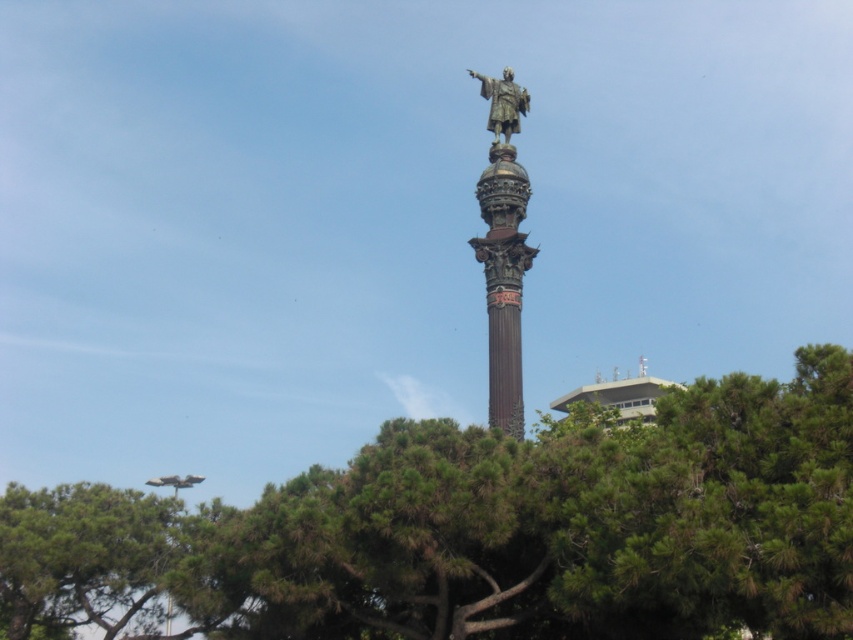
Question: Which object is the closest to the bronze statue at center?

Choices:
 (A) green textured tree at center
 (B) bronze statue at upper center

Answer: (B)

Question: Is green textured tree at center in front of bronze statue at upper center?

Choices:
 (A) yes
 (B) no

Answer: (A)

Question: Which object is positioned farthest from the bronze statue at upper center?

Choices:
 (A) green textured tree at center
 (B) bronze statue at center

Answer: (A)

Question: Estimate the real-world distances between objects in this image. Which object is farther from the green textured tree at center?

Choices:
 (A) bronze statue at center
 (B) bronze statue at upper center

Answer: (B)

Question: Is bronze statue at center further to the viewer compared to bronze statue at upper center?

Choices:
 (A) no
 (B) yes

Answer: (A)

Question: Does bronze statue at center have a lesser width compared to bronze statue at upper center?

Choices:
 (A) yes
 (B) no

Answer: (A)